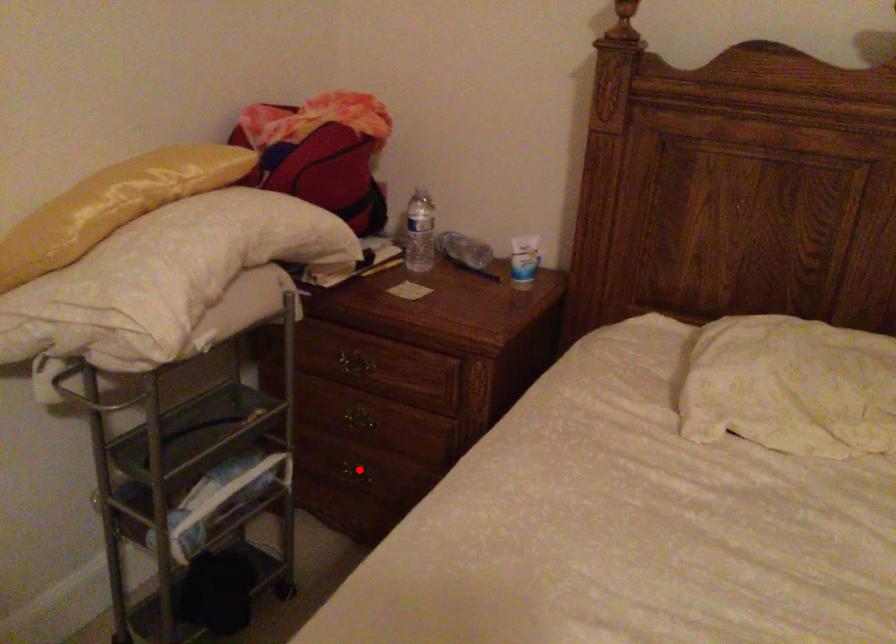
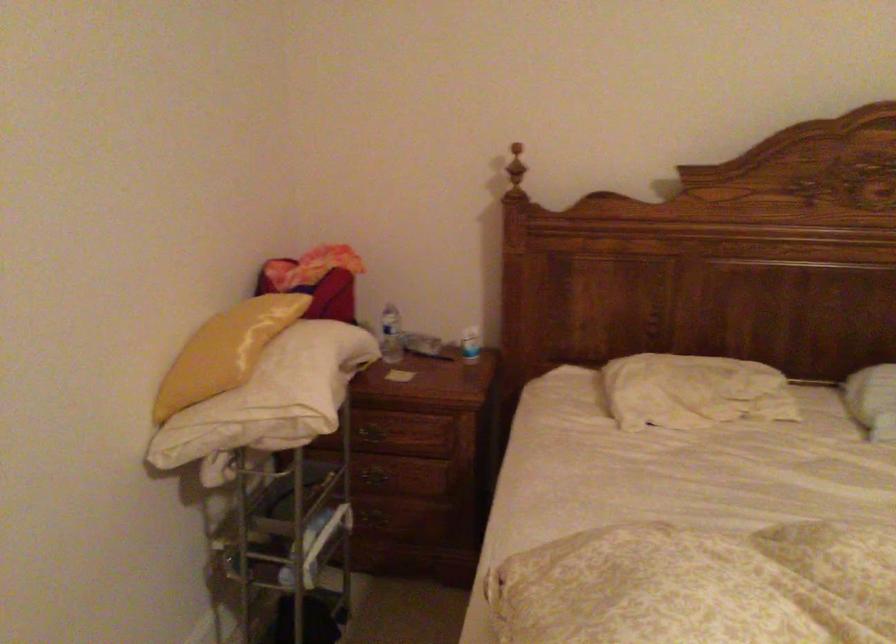
Question: A red point is marked in image1. In image2, is the corresponding 3D point closer to the camera or farther? Reply with the corresponding letter.

Choices:
 (A) The corresponding 3D point is closer.
 (B) The corresponding 3D point is farther.

Answer: (B)